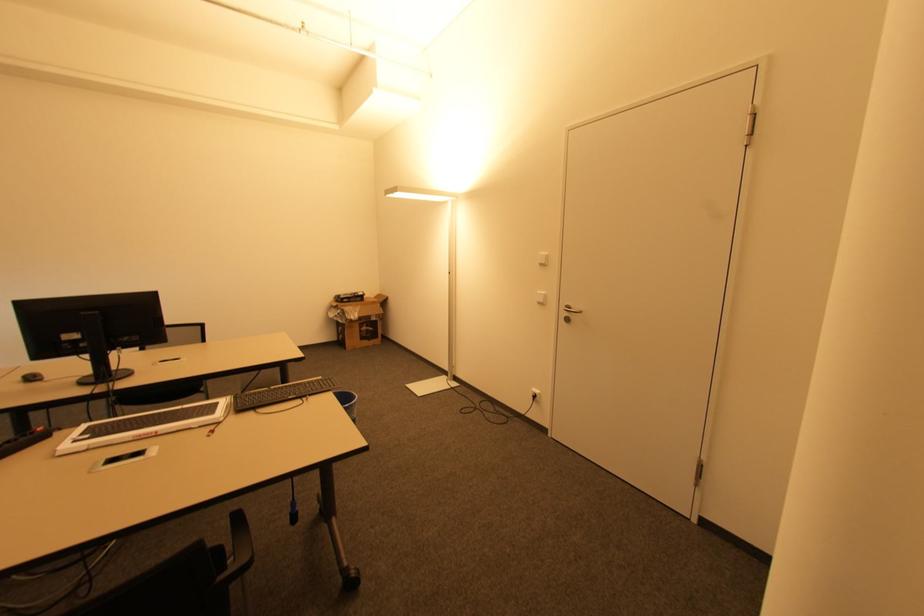
Where is `blue trash bin`? The height and width of the screenshot is (616, 924). blue trash bin is located at coordinates (347, 402).